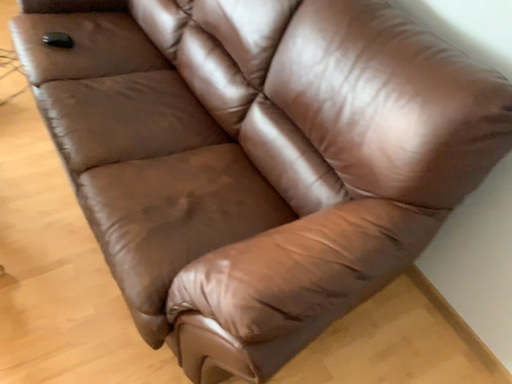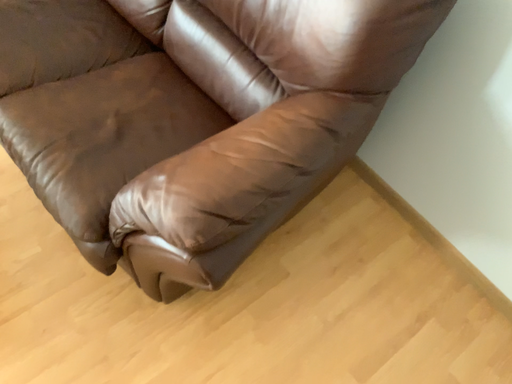
Question: Which way did the camera rotate in the video?

Choices:
 (A) rotated upward
 (B) rotated downward

Answer: (B)